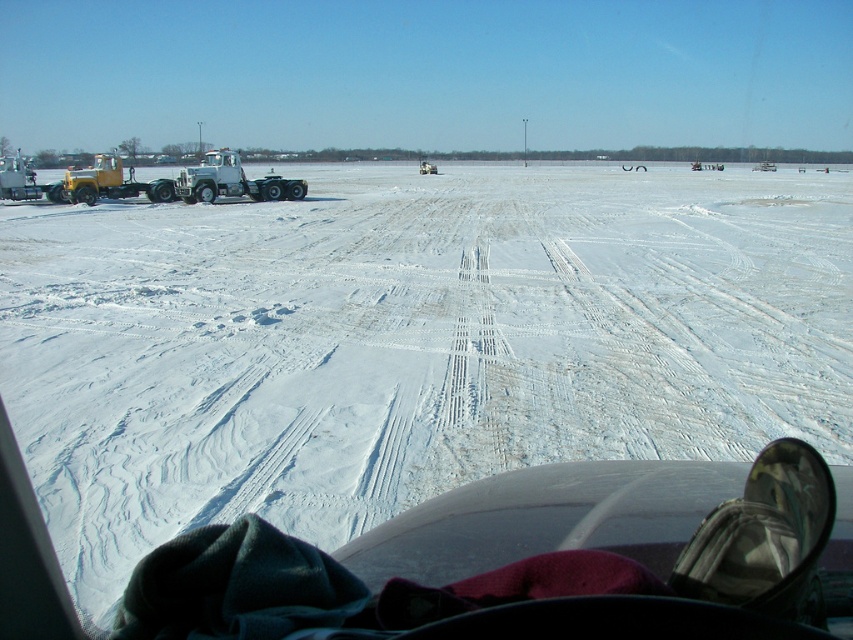
Question: Which of the following is the closest to the observer?

Choices:
 (A) white matte trailer truck at left
 (B) white powdery snow at center

Answer: (B)

Question: Can you confirm if white powdery snow at center is positioned below white matte trailer truck at left?

Choices:
 (A) yes
 (B) no

Answer: (A)

Question: Does white powdery snow at center have a greater width compared to white matte trailer truck at left?

Choices:
 (A) no
 (B) yes

Answer: (B)

Question: Which object is closer to the camera taking this photo?

Choices:
 (A) white powdery snow at center
 (B) white matte trailer truck at left

Answer: (A)

Question: Can you confirm if white powdery snow at center is bigger than white matte trailer truck at left?

Choices:
 (A) no
 (B) yes

Answer: (B)